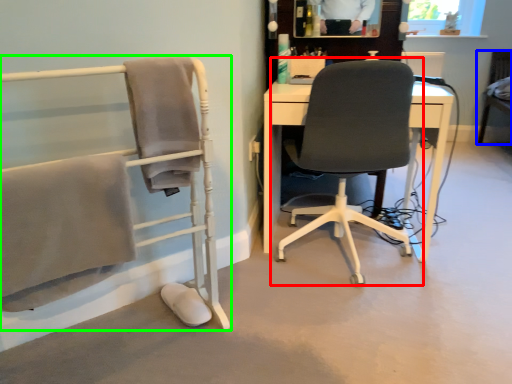
Question: Estimate the real-world distances between objects in this image. Which object is closer to chair (highlighted by a red box), chair (highlighted by a blue box) or chair (highlighted by a green box)?

Choices:
 (A) chair
 (B) chair

Answer: (B)